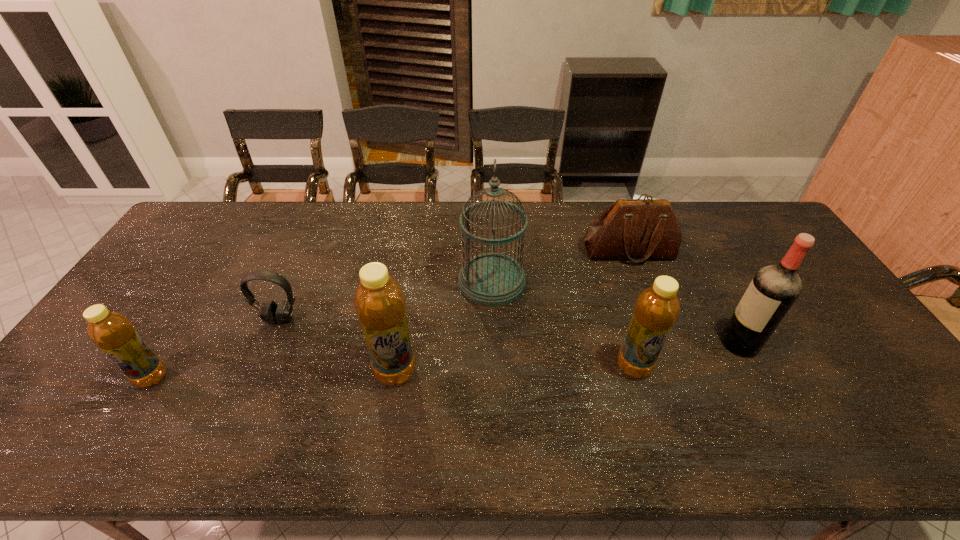
Identify the location of blank space located 0.240m on the front-facing side of the second object from left to right. (244, 404).

Find the location of `object that is at the far edge`. object that is at the far edge is located at coordinates (638, 229).

Image resolution: width=960 pixels, height=540 pixels. In order to click on vacant position at the far edge of the desktop in this screenshot , I will do `click(440, 241)`.

Where is `free space at the left edge`? free space at the left edge is located at coordinates (209, 259).

You are a GUI agent. You are given a task and a screenshot of the screen. Output one action in this format:
    pyautogui.click(x=<x>, y=<y>)
    Task: Click on the vacant space at the right edge of the desktop
    The width and height of the screenshot is (960, 540).
    Given the screenshot: What is the action you would take?
    pyautogui.click(x=836, y=304)

Identify the location of vacant point at the far left corner. Image resolution: width=960 pixels, height=540 pixels. (241, 202).

In the image, there is a desktop. At what (x,y) coordinates should I click in order to perform the action: click on free space at the far right corner. Please return your answer as a coordinate pair (x, y). The image size is (960, 540). Looking at the image, I should click on (730, 219).

At what (x,y) coordinates should I click in order to perform the action: click on vacant position at the near right corner of the desktop. Please return your answer as a coordinate pair (x, y). The height and width of the screenshot is (540, 960). Looking at the image, I should click on (879, 409).

This screenshot has height=540, width=960. In order to click on free area in between the fourth object from right to left and the second bottle from right to left in this screenshot , I will do `click(444, 327)`.

You are a GUI agent. You are given a task and a screenshot of the screen. Output one action in this format:
    pyautogui.click(x=<x>, y=<y>)
    Task: Click on the free area in between the second bottle from right to left and the leftmost bottle
    The height and width of the screenshot is (540, 960).
    Given the screenshot: What is the action you would take?
    pyautogui.click(x=274, y=375)